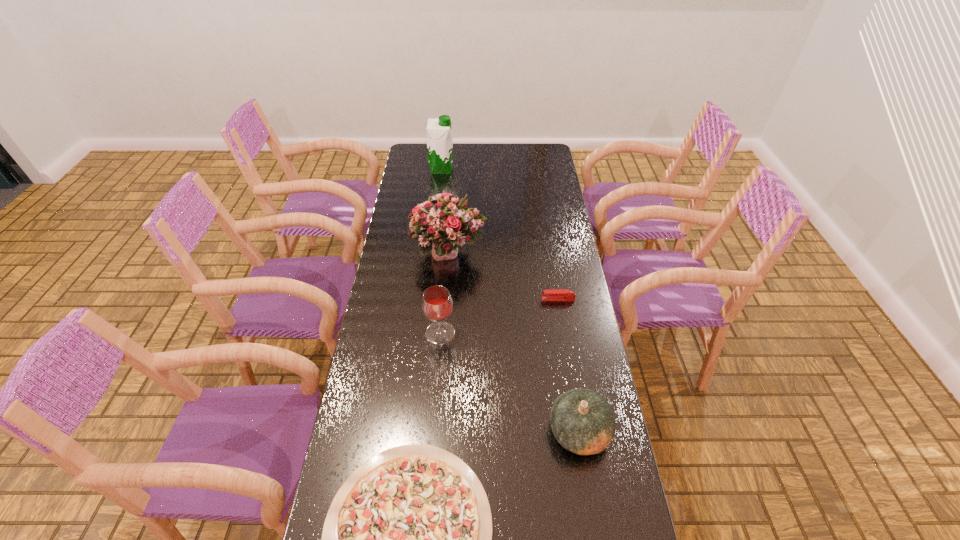
Locate an element on the screen. This screenshot has width=960, height=540. the farthest object is located at coordinates (439, 138).

The height and width of the screenshot is (540, 960). Identify the location of bouquet. (442, 223).

Locate an element on the screen. wineglass is located at coordinates (437, 304).

You are a GUI agent. You are given a task and a screenshot of the screen. Output one action in this format:
    pyautogui.click(x=<x>, y=<y>)
    Task: Click on the fourth shortest object
    The height and width of the screenshot is (540, 960).
    Given the screenshot: What is the action you would take?
    pyautogui.click(x=437, y=304)

The width and height of the screenshot is (960, 540). Identify the location of gourd. (582, 421).

This screenshot has height=540, width=960. I want to click on the third farthest object, so [x=558, y=294].

Identify the location of the fifth tallest object. This screenshot has width=960, height=540. (558, 294).

Image resolution: width=960 pixels, height=540 pixels. What are the coordinates of `free spot located 0.340m on the front-facing side of the soya milk` in the screenshot? It's located at (524, 169).

Identify the location of vacant space positioned 0.240m on the back of the second farthest object. (453, 195).

At what (x,y) coordinates should I click in order to perform the action: click on free spot located on the front of the fourth farthest object. Please return your answer as a coordinate pair (x, y). Looking at the image, I should click on (435, 402).